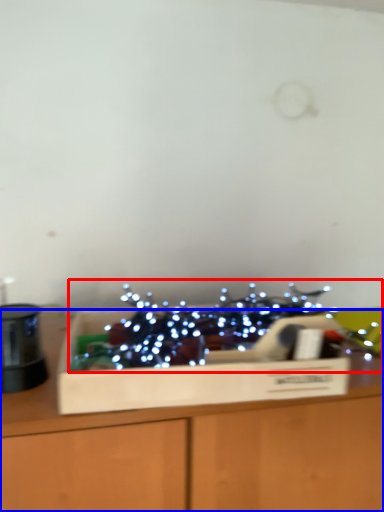
Question: Among these objects, which one is farthest to the camera, christmas decoration (highlighted by a red box) or table (highlighted by a blue box)?

Choices:
 (A) christmas decoration
 (B) table

Answer: (A)